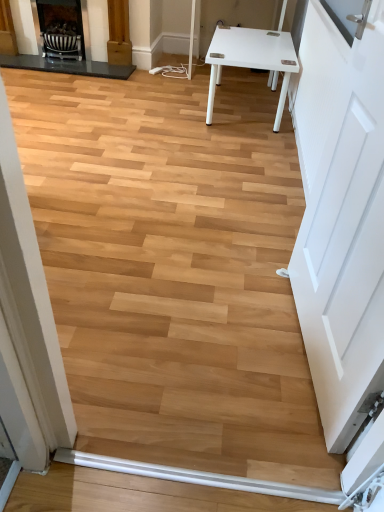
This screenshot has width=384, height=512. I want to click on free space above white smooth baseboard at lower center (from a real-world perspective), so click(201, 473).